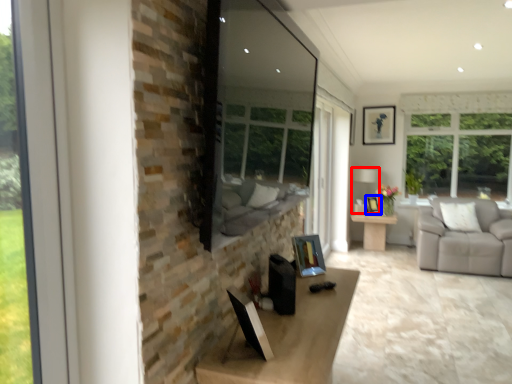
Question: Which object is further to the camera taking this photo, lamp (highlighted by a red box) or picture frame (highlighted by a blue box)?

Choices:
 (A) lamp
 (B) picture frame

Answer: (B)